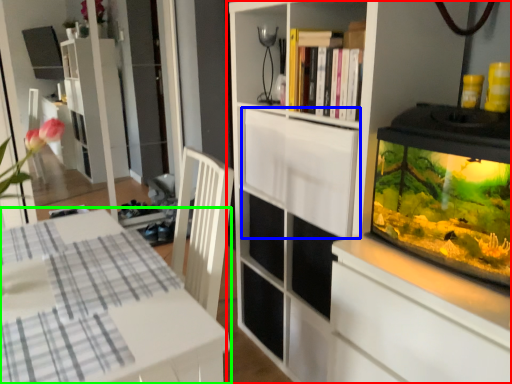
Question: Estimate the real-world distances between objects in this image. Which object is farther from cupboard (highlighted by a red box), cabinetry (highlighted by a blue box) or table (highlighted by a green box)?

Choices:
 (A) cabinetry
 (B) table

Answer: (B)